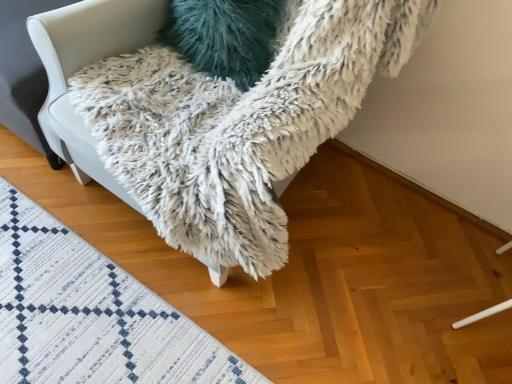
Where is `teal fuzzy pillow at upper center`? This screenshot has width=512, height=384. teal fuzzy pillow at upper center is located at coordinates (224, 36).

You are a GUI agent. You are given a task and a screenshot of the screen. Output one action in this format:
    pyautogui.click(x=<x>, y=<y>)
    Task: Click on the white fluffy blanket at upper center
    This screenshot has width=512, height=384.
    Given the screenshot: What is the action you would take?
    pyautogui.click(x=317, y=80)

I want to click on teal fuzzy pillow at upper center, so click(224, 36).

Relative to teal fuzzy pillow at upper center, is white fluffy blanket at upper center in front or behind?

white fluffy blanket at upper center is in front of teal fuzzy pillow at upper center.

In terms of width, does white fluffy blanket at upper center look wider or thinner when compared to teal fuzzy pillow at upper center?

white fluffy blanket at upper center is wider than teal fuzzy pillow at upper center.

Could you tell me if white fluffy blanket at upper center is turned towards teal fuzzy pillow at upper center?

No, white fluffy blanket at upper center does not turn towards teal fuzzy pillow at upper center.

From the image's perspective, which one is positioned higher, white fluffy blanket at upper center or teal fuzzy pillow at upper center?

teal fuzzy pillow at upper center, from the image's perspective.

Considering the points (40, 263) and (130, 45), which point is behind, point (40, 263) or point (130, 45)?

The point (40, 263) is behind.

In the scene shown: From a real-world perspective, relative to white fluffy blanket at upper center, is white woven mat at lower left vertically above or below?

Clearly, from a real-world perspective, white woven mat at lower left is below white fluffy blanket at upper center.

From the image's perspective, is white woven mat at lower left above white fluffy blanket at upper center?

No, from the image's perspective, white woven mat at lower left is not on top of white fluffy blanket at upper center.

Is point (193, 354) farther from camera compared to point (217, 27)?

Yes, it is behind point (217, 27).

From a real-world perspective, who is located lower, white woven mat at lower left or teal fuzzy pillow at upper center?

white woven mat at lower left, from a real-world perspective.

Is white woven mat at lower left situated inside teal fuzzy pillow at upper center or outside?

white woven mat at lower left lies outside teal fuzzy pillow at upper center.

Can you tell me how much white woven mat at lower left and teal fuzzy pillow at upper center differ in facing direction?

There is a 9.62-degree angle between the facing directions of white woven mat at lower left and teal fuzzy pillow at upper center.

Could you tell me if white fluffy blanket at upper center is turned towards white woven mat at lower left?

No, white fluffy blanket at upper center is not aimed at white woven mat at lower left.

Would you say white woven mat at lower left is part of white fluffy blanket at upper center's contents?

No, white woven mat at lower left is not inside white fluffy blanket at upper center.

Can you tell me how much white fluffy blanket at upper center and white woven mat at lower left differ in facing direction?

There is a 23.7-degree angle between the facing directions of white fluffy blanket at upper center and white woven mat at lower left.

Is white fluffy blanket at upper center at the right side of white woven mat at lower left?

Yes, white fluffy blanket at upper center is to the right of white woven mat at lower left.

Is teal fuzzy pillow at upper center oriented away from white fluffy blanket at upper center?

Correct, teal fuzzy pillow at upper center is looking away from white fluffy blanket at upper center.

Which of these two, teal fuzzy pillow at upper center or white fluffy blanket at upper center, stands taller?

white fluffy blanket at upper center is taller.

Is teal fuzzy pillow at upper center not near white fluffy blanket at upper center?

teal fuzzy pillow at upper center is actually quite close to white fluffy blanket at upper center.

Is white woven mat at lower left located within teal fuzzy pillow at upper center?

No, white woven mat at lower left is not inside teal fuzzy pillow at upper center.

Considering the sizes of objects teal fuzzy pillow at upper center and white woven mat at lower left in the image provided, who is taller, teal fuzzy pillow at upper center or white woven mat at lower left?

teal fuzzy pillow at upper center.

Looking at their sizes, would you say teal fuzzy pillow at upper center is wider or thinner than white woven mat at lower left?

Considering their sizes, teal fuzzy pillow at upper center looks slimmer than white woven mat at lower left.

From a real-world perspective, is teal fuzzy pillow at upper center physically below white woven mat at lower left?

No, from a real-world perspective, teal fuzzy pillow at upper center is not beneath white woven mat at lower left.

Where is `pillow on the left of white fluffy blanket at upper center`? pillow on the left of white fluffy blanket at upper center is located at coordinates (224, 36).

Where is `furniture in front of the white woven mat at lower left`? This screenshot has height=384, width=512. furniture in front of the white woven mat at lower left is located at coordinates (317, 80).

Which object lies nearer to the anchor point teal fuzzy pillow at upper center, white woven mat at lower left or white fluffy blanket at upper center?

Based on the image, white fluffy blanket at upper center appears to be nearer to teal fuzzy pillow at upper center.

Estimate the real-world distances between objects in this image. Which object is closer to white woven mat at lower left, teal fuzzy pillow at upper center or white fluffy blanket at upper center?

Based on the image, white fluffy blanket at upper center appears to be nearer to white woven mat at lower left.

From the image, which object appears to be nearer to teal fuzzy pillow at upper center, white fluffy blanket at upper center or white woven mat at lower left?

white fluffy blanket at upper center.

Estimate the real-world distances between objects in this image. Which object is further from white fluffy blanket at upper center, teal fuzzy pillow at upper center or white woven mat at lower left?

The object further to white fluffy blanket at upper center is white woven mat at lower left.

Looking at the image, which one is located closer to white woven mat at lower left, white fluffy blanket at upper center or teal fuzzy pillow at upper center?

white fluffy blanket at upper center is closer to white woven mat at lower left.

Looking at the image, which one is located further to white fluffy blanket at upper center, white woven mat at lower left or teal fuzzy pillow at upper center?

white woven mat at lower left is positioned further to the anchor white fluffy blanket at upper center.

Locate an element on the screen. This screenshot has height=384, width=512. furniture between teal fuzzy pillow at upper center and white woven mat at lower left in the vertical direction is located at coordinates coord(317,80).